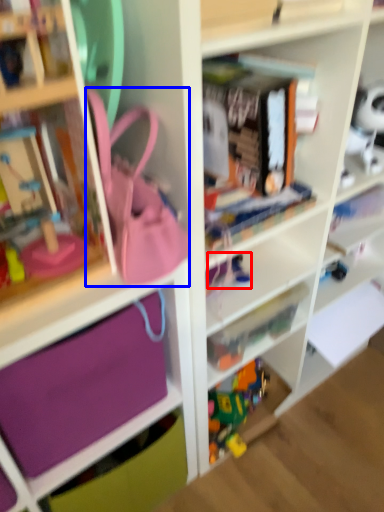
Question: Which of the following is the closest to the observer, toy (highlighted by a red box) or accessory (highlighted by a blue box)?

Choices:
 (A) toy
 (B) accessory

Answer: (B)